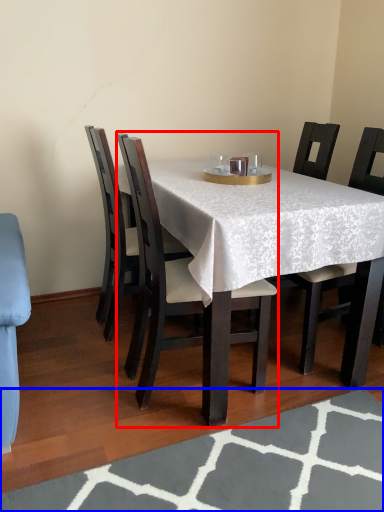
Question: Which object appears closest to the camera in this image, chair (highlighted by a red box) or place mat (highlighted by a blue box)?

Choices:
 (A) chair
 (B) place mat

Answer: (B)